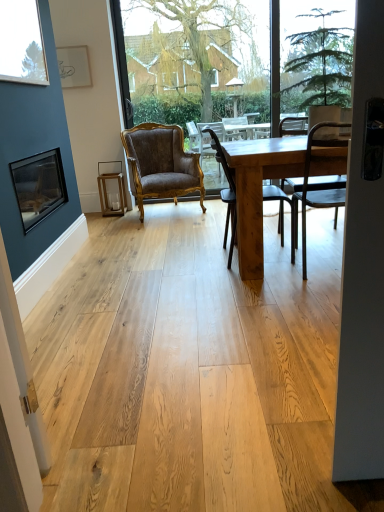
Question: Can you confirm if green leafy plant at center, the 1th window screen when ordered from front to back, is thinner than wooden chair at center, the second chair in the back-to-front sequence?

Choices:
 (A) no
 (B) yes

Answer: (B)

Question: Can you confirm if green leafy plant at center, the 1th window screen when ordered from front to back, is bigger than wooden chair at center, acting as the 2th chair starting from the right?

Choices:
 (A) no
 (B) yes

Answer: (B)

Question: From a real-world perspective, does green leafy plant at center, the 1th window screen when ordered from front to back, stand above wooden chair at center, the 2th chair positioned from the left?

Choices:
 (A) no
 (B) yes

Answer: (B)

Question: Considering the relative sizes of green leafy plant at center, the second window screen positioned from the back, and wooden chair at center, marked as the second chair in a front-to-back arrangement, in the image provided, is green leafy plant at center, the second window screen positioned from the back, wider than wooden chair at center, marked as the second chair in a front-to-back arrangement,?

Choices:
 (A) yes
 (B) no

Answer: (B)

Question: Considering the relative sizes of green leafy plant at center, the second window screen positioned from the back, and wooden chair at center, the second chair in the back-to-front sequence, in the image provided, is green leafy plant at center, the second window screen positioned from the back, taller than wooden chair at center, the second chair in the back-to-front sequence,?

Choices:
 (A) yes
 (B) no

Answer: (B)

Question: Does green leafy plant at center, the second window screen positioned from the back, appear on the right side of wooden chair at center, the 2th chair positioned from the left?

Choices:
 (A) yes
 (B) no

Answer: (A)

Question: Can you confirm if clear glass window at upper left is positioned to the right of wooden chair at center, which ranks as the first window screen in back-to-front order?

Choices:
 (A) no
 (B) yes

Answer: (A)

Question: Considering the relative positions of clear glass window at upper left and wooden chair at center, which is the 2th window screen in front-to-back order, in the image provided, is clear glass window at upper left to the left of wooden chair at center, which is the 2th window screen in front-to-back order, from the viewer's perspective?

Choices:
 (A) no
 (B) yes

Answer: (B)

Question: From the image's perspective, is clear glass window at upper left above wooden chair at center, which ranks as the first window screen in back-to-front order?

Choices:
 (A) no
 (B) yes

Answer: (A)

Question: Does clear glass window at upper left have a smaller size compared to wooden chair at center, which is the 2th window screen in front-to-back order?

Choices:
 (A) no
 (B) yes

Answer: (B)

Question: Is clear glass window at upper left wider than wooden chair at center, which is the 2th window screen in front-to-back order?

Choices:
 (A) yes
 (B) no

Answer: (B)

Question: Is the depth of clear glass window at upper left greater than that of wooden chair at center, which ranks as the first window screen in back-to-front order?

Choices:
 (A) yes
 (B) no

Answer: (B)

Question: Is the position of clear glass window at upper left less distant than that of matte black picture frame at left?

Choices:
 (A) yes
 (B) no

Answer: (A)